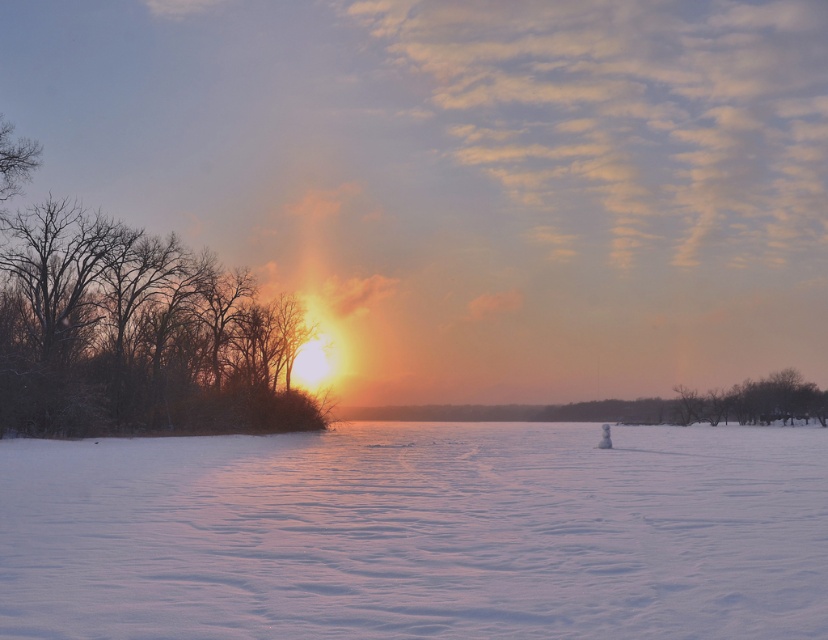
Question: Among these points, which one is farthest from the camera?

Choices:
 (A) (797, 417)
 (B) (263, 342)

Answer: (A)

Question: Can you confirm if white matte snow at center is positioned to the right of smooth brown tree at right?

Choices:
 (A) yes
 (B) no

Answer: (B)

Question: Which point is closer to the camera?

Choices:
 (A) (619, 508)
 (B) (804, 400)

Answer: (A)

Question: Does white matte snow at center have a greater width compared to snow-covered trees at left?

Choices:
 (A) yes
 (B) no

Answer: (A)

Question: Which point is closer to the camera taking this photo?

Choices:
 (A) (725, 392)
 (B) (114, 314)
 (C) (651, 568)

Answer: (C)

Question: Can you confirm if snow-covered trees at left is thinner than smooth brown tree at right?

Choices:
 (A) yes
 (B) no

Answer: (A)